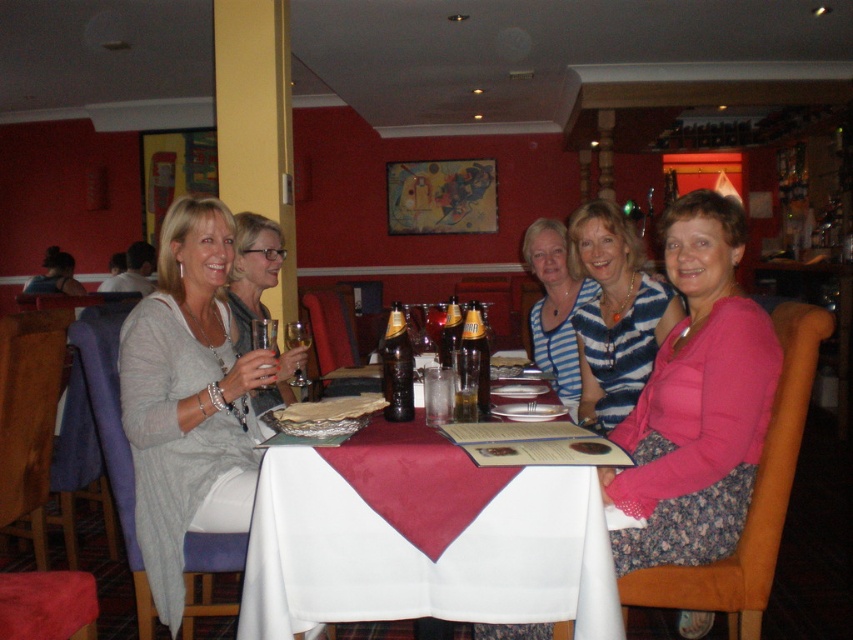
You are a server in a restaurant. You need to place a 12 inch tall vase on the table. The striped knit sweater at center is currently on the table. Can the vase be placed on the white satin table at center without moving the sweater?

The white satin table at center is shorter than striped knit sweater at center, so the table is not tall enough to accommodate a 12 inch tall vase without the risk of it being unstable or toppling over. Please consider moving the sweater or choosing a taller surface.

You are a waiter in a restaurant and need to place a new drink order on the table. Which object should you approach first if you want to reach the white satin table at center and the striped knit sweater at center from the right side of the image?

The striped knit sweater at center should be approached first because the white satin table at center is to the left of it, meaning the sweater is closer when coming from the right side.